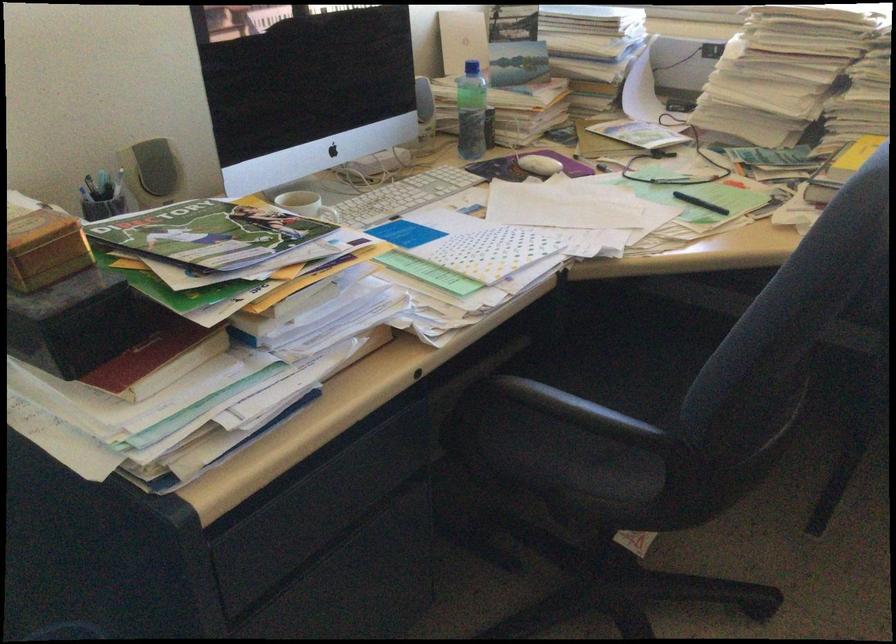
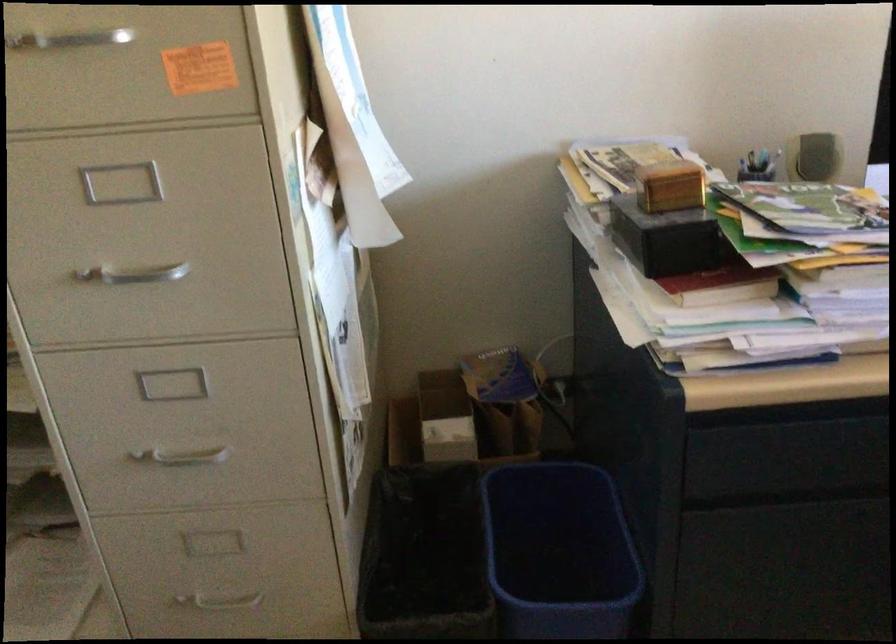
The point at (74,333) is marked in the first image. Where is the corresponding point in the second image?

(668, 239)